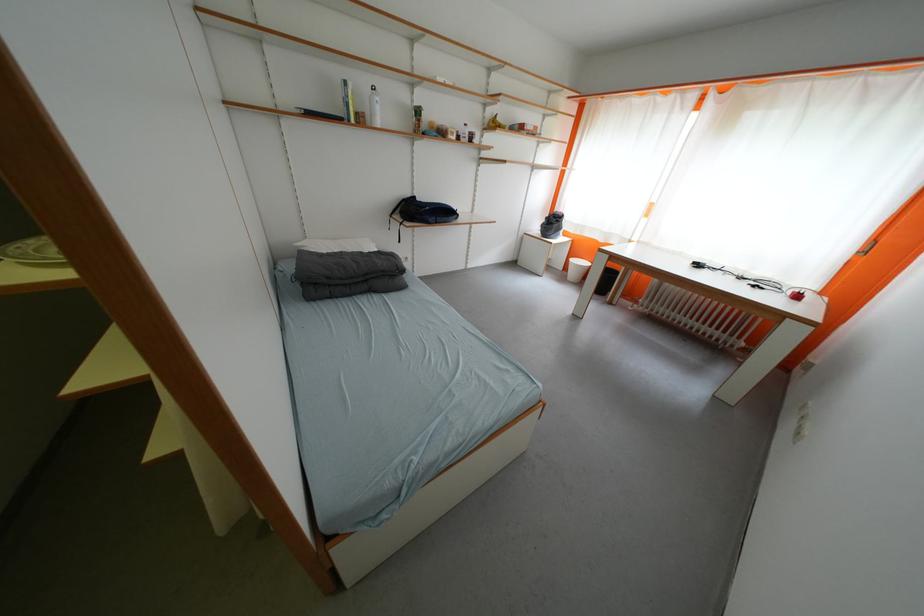
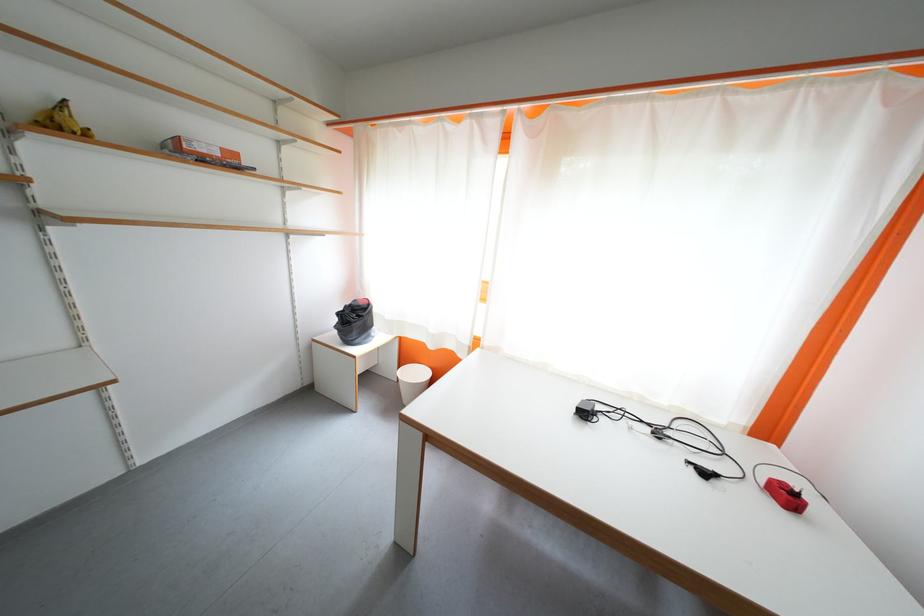
Find the pixel in the second image that matches pixel 763 290 in the first image.

(713, 477)